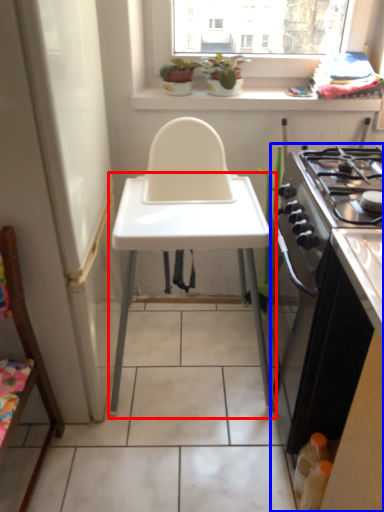
Question: Which of the following is the farthest to the observer, changing table (highlighted by a red box) or cabinetry (highlighted by a blue box)?

Choices:
 (A) changing table
 (B) cabinetry

Answer: (A)